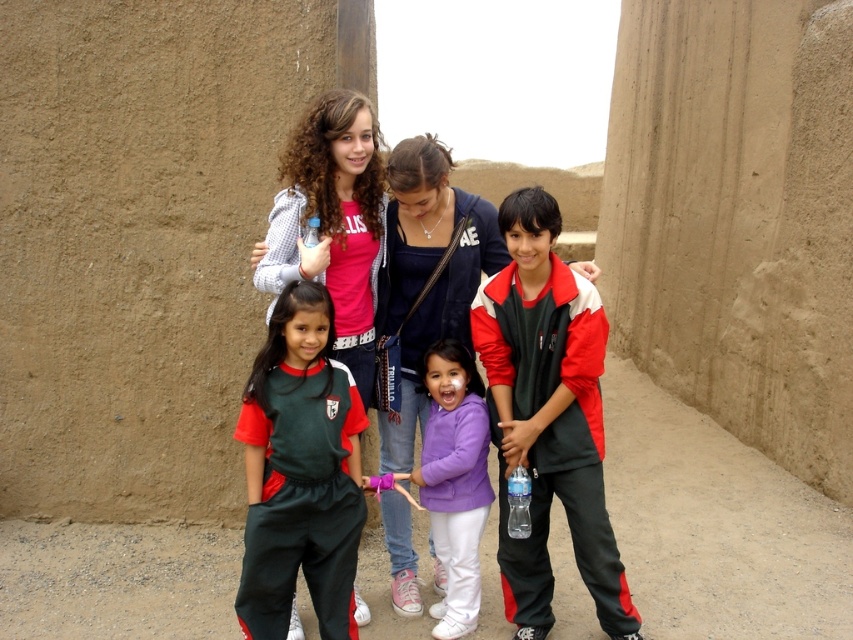
Question: Which point is farther to the camera?

Choices:
 (A) (607, 545)
 (B) (508, 506)
 (C) (440, 406)

Answer: (C)

Question: Is dark green jersey at center further to camera compared to purple fleece jacket at center?

Choices:
 (A) no
 (B) yes

Answer: (A)

Question: Which of these objects is positioned farthest from the purple fleece jacket at center?

Choices:
 (A) red and white jacket at center
 (B) dark green jersey at center
 (C) clear plastic bottle at center

Answer: (B)

Question: Where is matte green tracksuit at center located in relation to purple fleece jacket at center in the image?

Choices:
 (A) right
 (B) left

Answer: (B)

Question: Which object appears farthest from the camera in this image?

Choices:
 (A) clear plastic bottle at center
 (B) red and white jacket at center
 (C) matte green tracksuit at center
 (D) dark green jersey at center

Answer: (C)

Question: Observing the image, what is the correct spatial positioning of red and white jacket at center in reference to matte green tracksuit at center?

Choices:
 (A) right
 (B) left

Answer: (A)